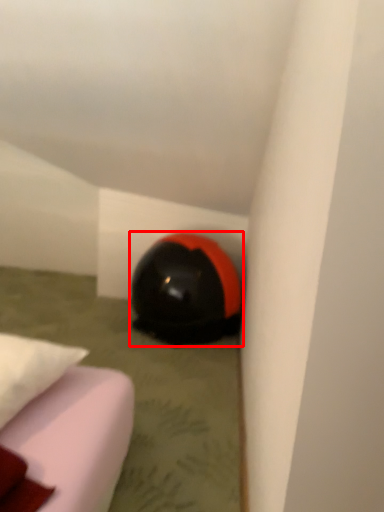
Question: From the image's perspective, where is helmet (annotated by the red box) located in relation to pillow in the image?

Choices:
 (A) above
 (B) below

Answer: (A)